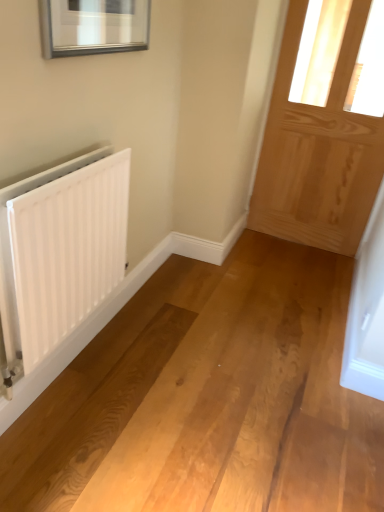
Where is `free point below white matte radiator at left (from a real-world perspective)`? The image size is (384, 512). free point below white matte radiator at left (from a real-world perspective) is located at coordinates (85, 362).